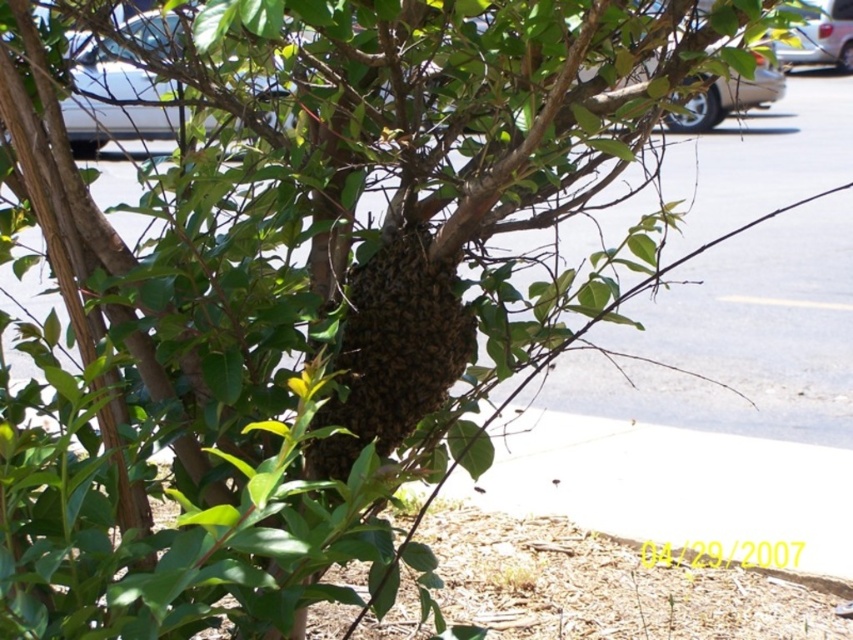
You are a delivery person needing to park your vehicle in the parking lot shown. You see the metallic silver car at upper left and the metallic gold car at upper center. Which car is closer to the tree with the bee swarm?

The metallic silver car at upper left is closer to the tree with the bee swarm because it is located below the metallic gold car at upper center, meaning it is positioned lower in the image, which corresponds to being nearer to the tree.

You are a beekeeper trying to assess the situation. You see the brown fuzzy beehive at center and the metallic gold car at upper center. Which object is higher in the image?

The brown fuzzy beehive at center is taller than the metallic gold car at upper center, so the brown fuzzy beehive at center is higher in the image.